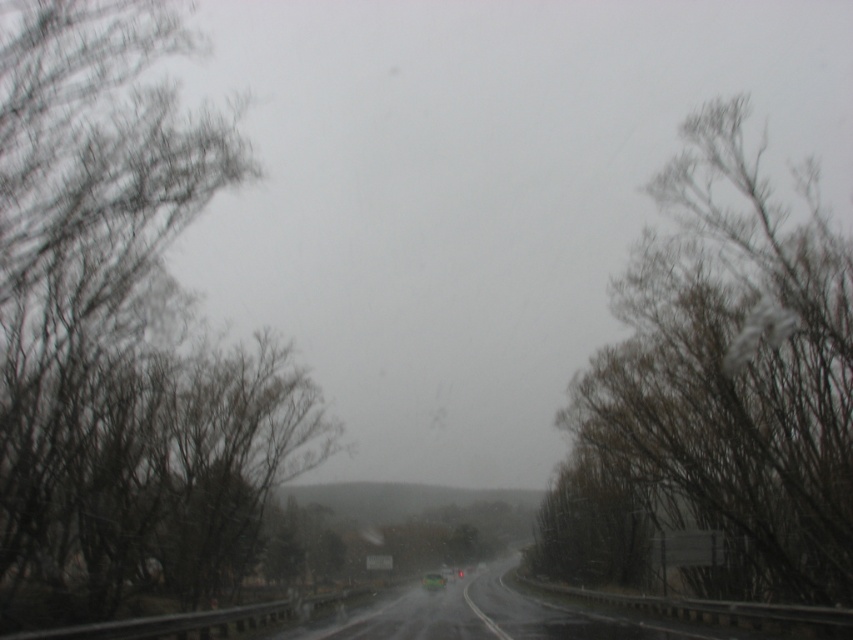
In the scene shown: You are driving a car that is 4.5 meters long. You need to cross the road while avoiding the bare branches at right and the smooth asphalt highway at center. Can your car fit between them without touching either?

The distance between the bare branches at right and the smooth asphalt highway at center is 5.83 meters. Since your car is 4.5 meters long, it can fit between them without touching either.

You are standing at the center of the road in the image. Which direction should you look to see the bare branches at right?

You should look to the right to see the bare branches at right, as they are located at the right side of the image.